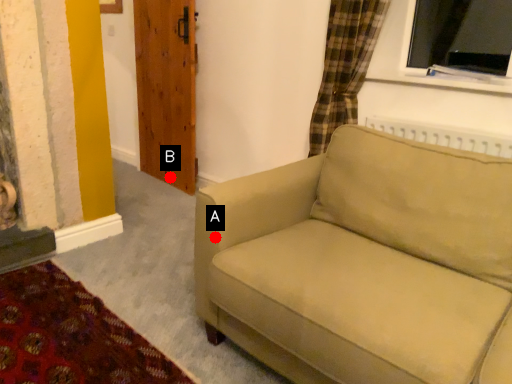
Question: Two points are circled on the image, labeled by A and B beside each circle. Which point appears closest to the camera in this image?

Choices:
 (A) A is closer
 (B) B is closer

Answer: (A)